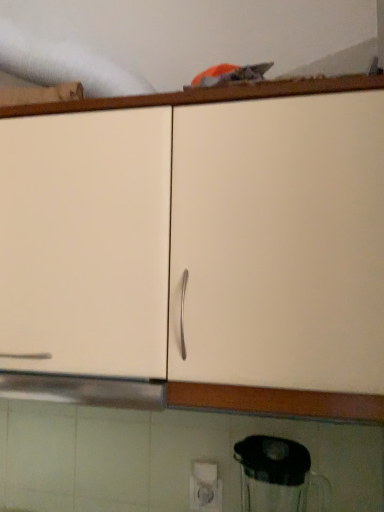
The width and height of the screenshot is (384, 512). Describe the element at coordinates (203, 244) in the screenshot. I see `matte white cabinet at center` at that location.

At what (x,y) coordinates should I click in order to perform the action: click on matte white cabinet at center. Please return your answer as a coordinate pair (x, y). The height and width of the screenshot is (512, 384). Looking at the image, I should click on (203, 244).

This screenshot has width=384, height=512. I want to click on matte white cabinet at center, so pos(203,244).